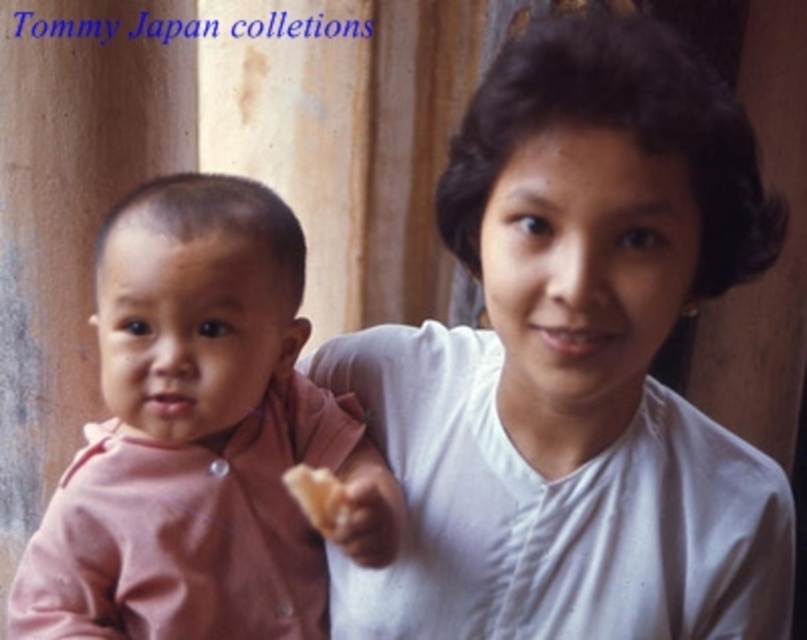
Does white matte shirt at upper right appear on the right side of white crumbly bread at center?

Indeed, white matte shirt at upper right is positioned on the right side of white crumbly bread at center.

Which is behind, point (337, 588) or point (329, 484)?

Point (337, 588)

The width and height of the screenshot is (807, 640). Identify the location of white matte shirt at upper right. (575, 364).

Is pink fabric baby at center smaller than white crumbly bread at center?

Incorrect, pink fabric baby at center is not smaller in size than white crumbly bread at center.

At what (x,y) coordinates should I click in order to perform the action: click on pink fabric baby at center. Please return your answer as a coordinate pair (x, y). Looking at the image, I should click on (199, 435).

Locate an element on the screen. The image size is (807, 640). pink fabric baby at center is located at coordinates (199, 435).

Is point (684, 70) farther from viewer compared to point (195, 563)?

No, (684, 70) is closer to viewer.

Between white matte shirt at upper right and pink fabric baby at center, which one has more height?

white matte shirt at upper right is taller.

Describe the element at coordinates (575, 364) in the screenshot. I see `white matte shirt at upper right` at that location.

You are a GUI agent. You are given a task and a screenshot of the screen. Output one action in this format:
    pyautogui.click(x=<x>, y=<y>)
    Task: Click on the white matte shirt at upper right
    This screenshot has width=807, height=640.
    Given the screenshot: What is the action you would take?
    pyautogui.click(x=575, y=364)